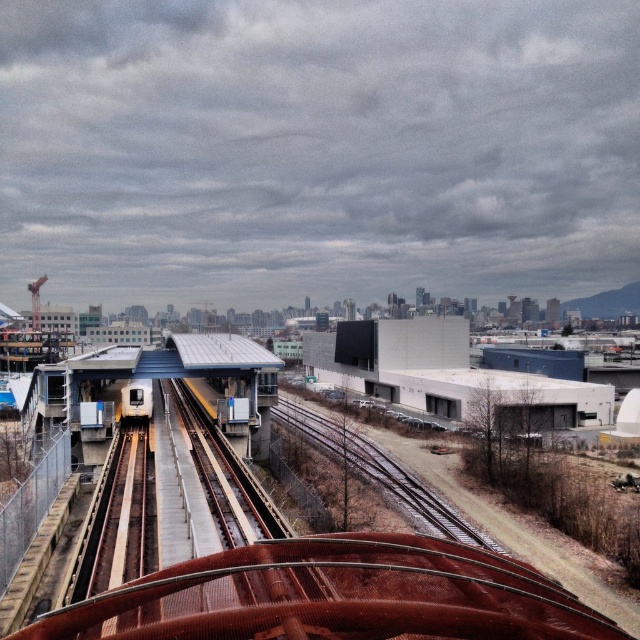
What do you see at coordinates (449, 376) in the screenshot? This screenshot has height=640, width=640. I see `gray concrete building at center` at bounding box center [449, 376].

Is gray concrete building at center above metallic silver train at center?

Yes.

Is point (531, 372) positioned before point (145, 384)?

No.

The image size is (640, 640). I want to click on gray concrete building at center, so click(449, 376).